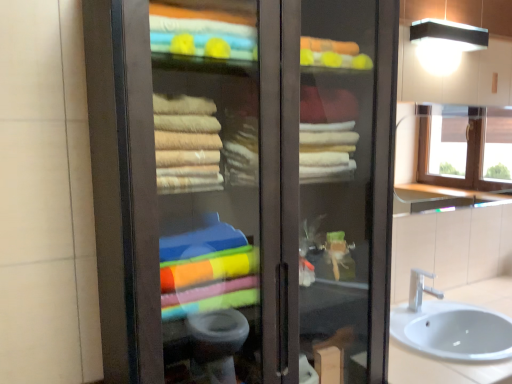
I want to click on unoccupied area behind silver metallic faucet at lower right, so click(425, 304).